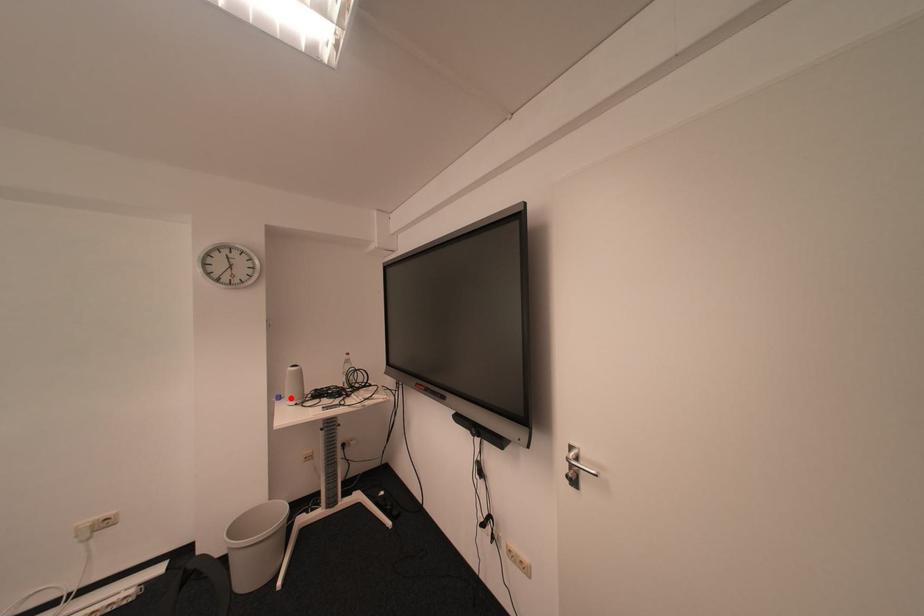
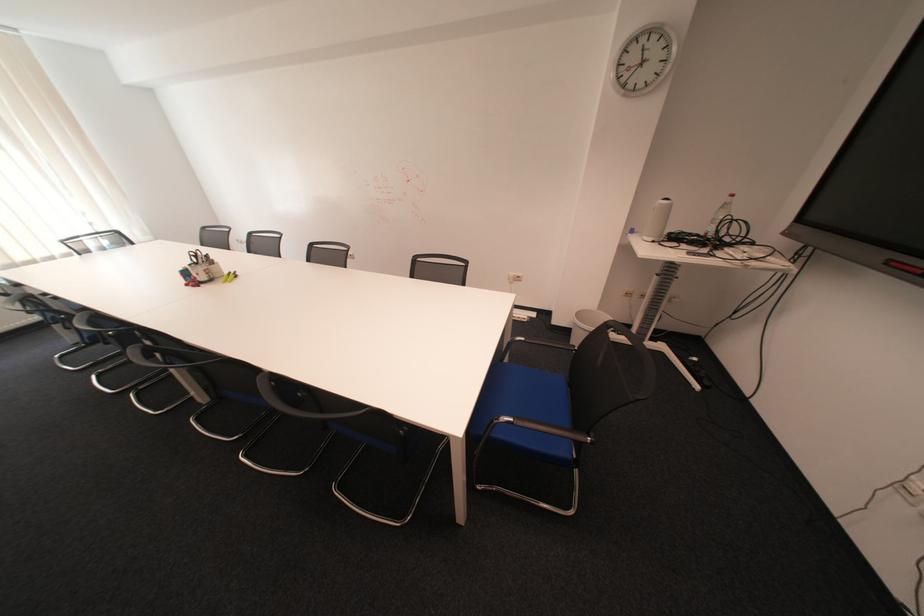
Find the pixel in the second image that matches the highlighted location in the first image.

(643, 232)